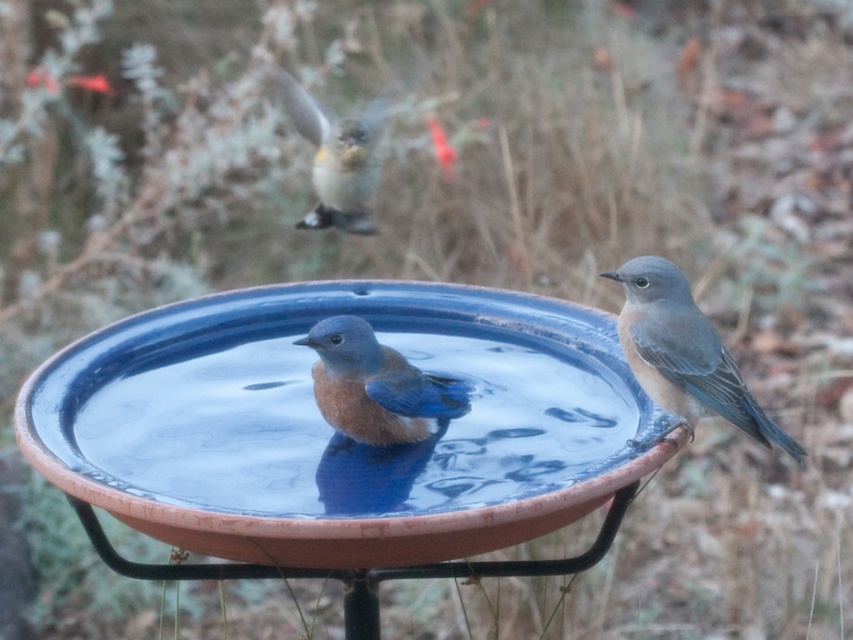
Question: Which point is farther from the camera taking this photo?

Choices:
 (A) (329, 202)
 (B) (416, 433)
 (C) (660, 403)

Answer: (A)

Question: Can you confirm if blue-gray feathers at center is positioned below blue glossy bird at upper center?

Choices:
 (A) no
 (B) yes

Answer: (B)

Question: Can you confirm if blue glossy bird at center is positioned below blue glossy bird at upper center?

Choices:
 (A) yes
 (B) no

Answer: (A)

Question: Is blue glossy bird at center thinner than blue glossy bird at upper center?

Choices:
 (A) no
 (B) yes

Answer: (B)

Question: Which point is farther from the camera taking this photo?

Choices:
 (A) (386, 410)
 (B) (373, 180)

Answer: (B)

Question: Which object is farther from the camera taking this photo?

Choices:
 (A) blue-gray feathers at center
 (B) blue glossy bird at center
 (C) blue glossy bird at upper center

Answer: (C)